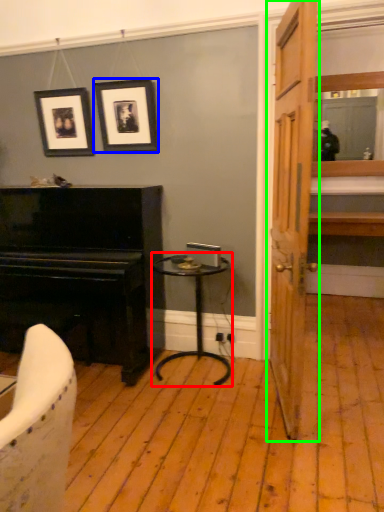
Question: Based on their relative distances, which object is farther from table (highlighted by a red box)? Choose from picture frame (highlighted by a blue box) and door (highlighted by a green box).

Choices:
 (A) picture frame
 (B) door

Answer: (A)